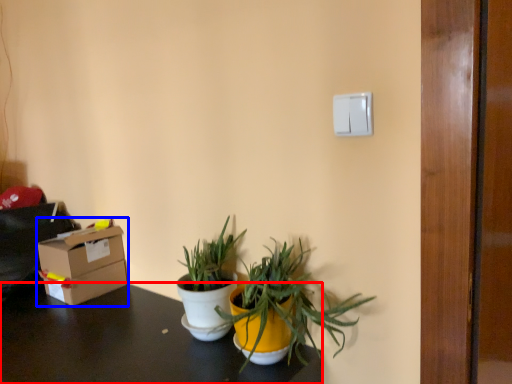
Question: Among these objects, which one is farthest to the camera, desk (highlighted by a red box) or box (highlighted by a blue box)?

Choices:
 (A) desk
 (B) box

Answer: (B)